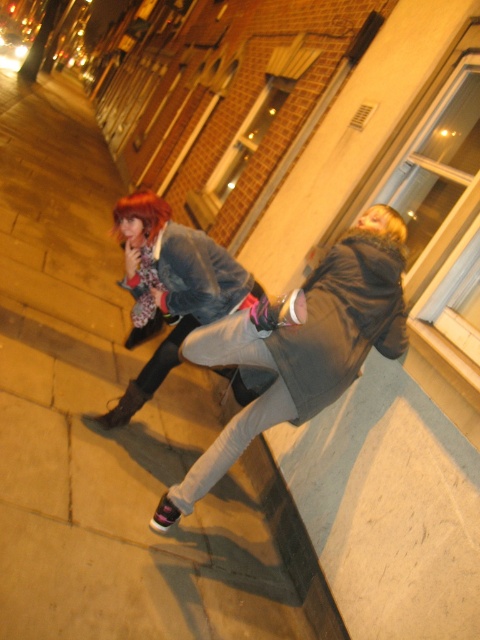
Who is shorter, dark gray hoodie at center or shiny red hair at upper left?

With less height is shiny red hair at upper left.

Between dark gray hoodie at center and shiny red hair at upper left, which one is positioned higher?

Positioned higher is shiny red hair at upper left.

In order to click on dark gray hoodie at center in this screenshot , I will do `click(298, 353)`.

In order to click on dark gray hoodie at center in this screenshot , I will do `click(298, 353)`.

Can you confirm if concrete at lower left is positioned above dark gray hoodie at center?

Indeed, concrete at lower left is positioned over dark gray hoodie at center.

Does concrete at lower left appear under dark gray hoodie at center?

Actually, concrete at lower left is above dark gray hoodie at center.

The height and width of the screenshot is (640, 480). I want to click on concrete at lower left, so click(103, 428).

Where is `concrete at lower left`? concrete at lower left is located at coordinates (103, 428).

Can you confirm if concrete at lower left is positioned below blondehair at right?

No.

The height and width of the screenshot is (640, 480). What do you see at coordinates (103, 428) in the screenshot?
I see `concrete at lower left` at bounding box center [103, 428].

You are a GUI agent. You are given a task and a screenshot of the screen. Output one action in this format:
    pyautogui.click(x=<x>, y=<y>)
    Task: Click on the concrete at lower left
    Image resolution: width=480 pixels, height=640 pixels.
    Given the screenshot: What is the action you would take?
    pyautogui.click(x=103, y=428)